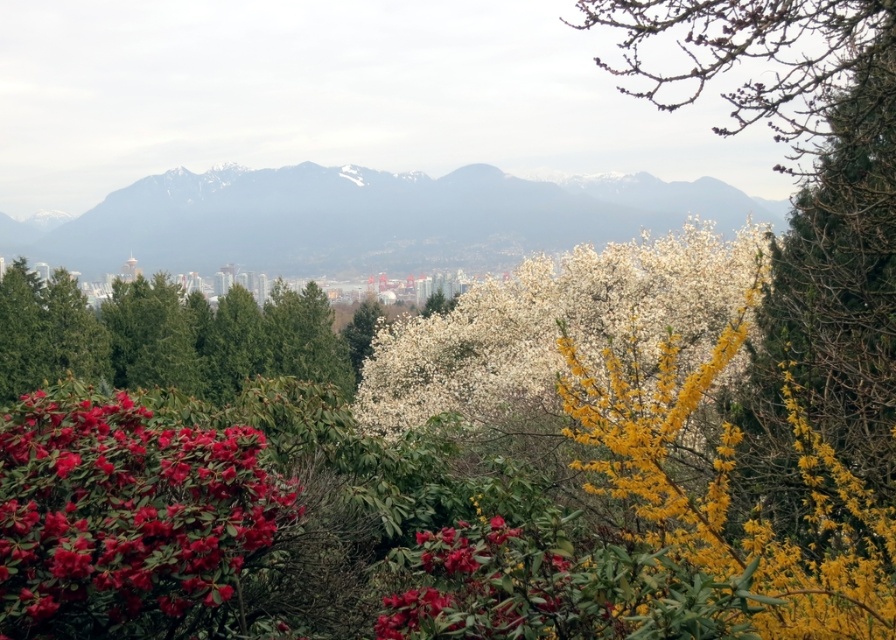
You are a landscape photographer planning to capture the city view. You notice the white fluffy blossoms at center and the green matte tree at left. Which object would block your view of the city if placed between you and the city?

The green matte tree at left would block your view of the city because it is wider than the white fluffy blossoms at center, which is thinner.

You are standing in the scenic area and want to take a photo that includes both the white fluffy blossoms at center and the green matte tree at left. Which object should you focus on first to ensure both are in clear view?

You should focus on the white fluffy blossoms at center first because it is closer to the viewer than the green matte tree at left, so adjusting focus from near to far will help both be in clear view.